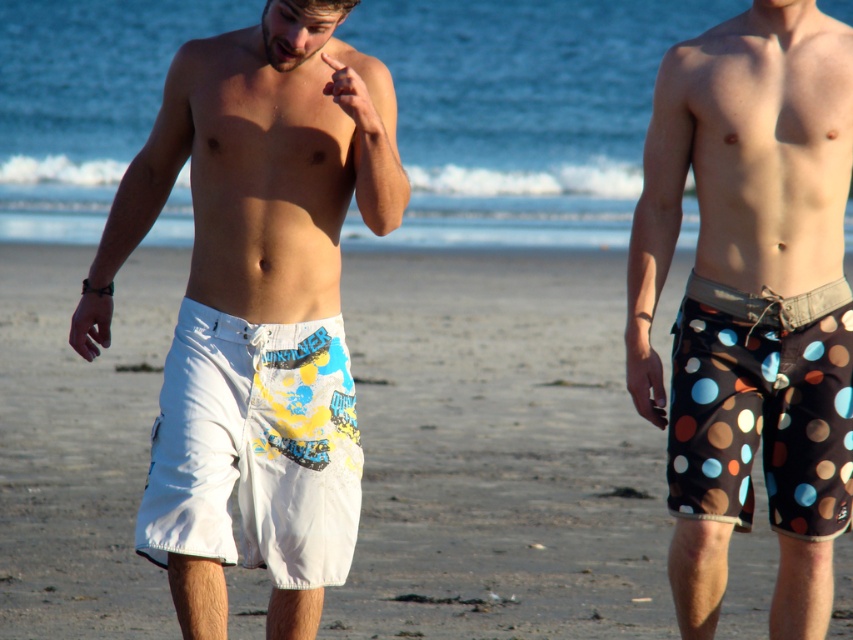
Question: Is white printed boardshorts at center bigger than brown polka dot fabric shorts at right?

Choices:
 (A) no
 (B) yes

Answer: (B)

Question: Which point is closer to the camera?

Choices:
 (A) white fabric shorts at center
 (B) white printed boardshorts at center
 (C) polka dot fabric shorts at center

Answer: (B)

Question: Observing the image, what is the correct spatial positioning of white fabric shorts at center in reference to polka dot fabric shorts at center?

Choices:
 (A) above
 (B) below

Answer: (A)

Question: From the image, what is the correct spatial relationship of polka dot fabric shorts at center in relation to white cotton shorts at center?

Choices:
 (A) left
 (B) right

Answer: (B)

Question: Which object appears farthest from the camera in this image?

Choices:
 (A) white fabric shorts at center
 (B) white cotton shorts at center

Answer: (A)

Question: Which point is farther to the camera?

Choices:
 (A) polka dot fabric shorts at center
 (B) white cotton shorts at center
 (C) white fabric shorts at center
 (D) brown polka dot fabric shorts at right

Answer: (C)